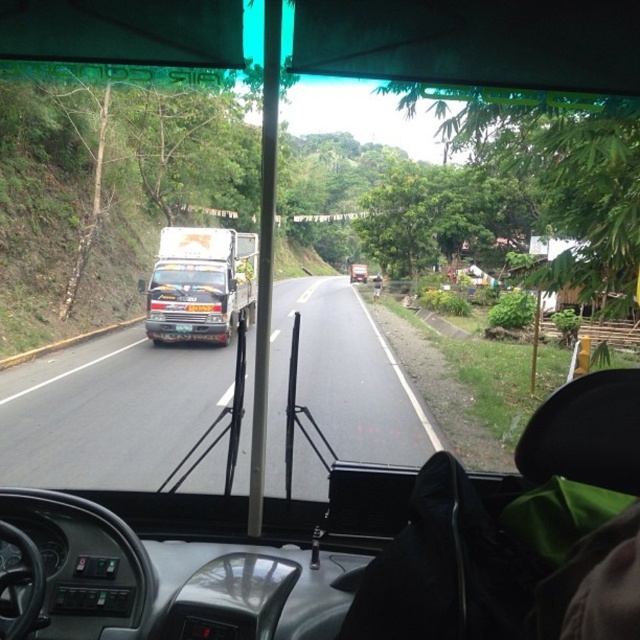
Which is more to the left, black matte truck at left or metallic silver truck at center?

metallic silver truck at center

Which is behind, point (291, 296) or point (211, 237)?

Point (291, 296)

Does point (288, 355) lie behind point (176, 273)?

No, (288, 355) is closer to viewer.

Image resolution: width=640 pixels, height=640 pixels. I want to click on black matte truck at left, so click(108, 412).